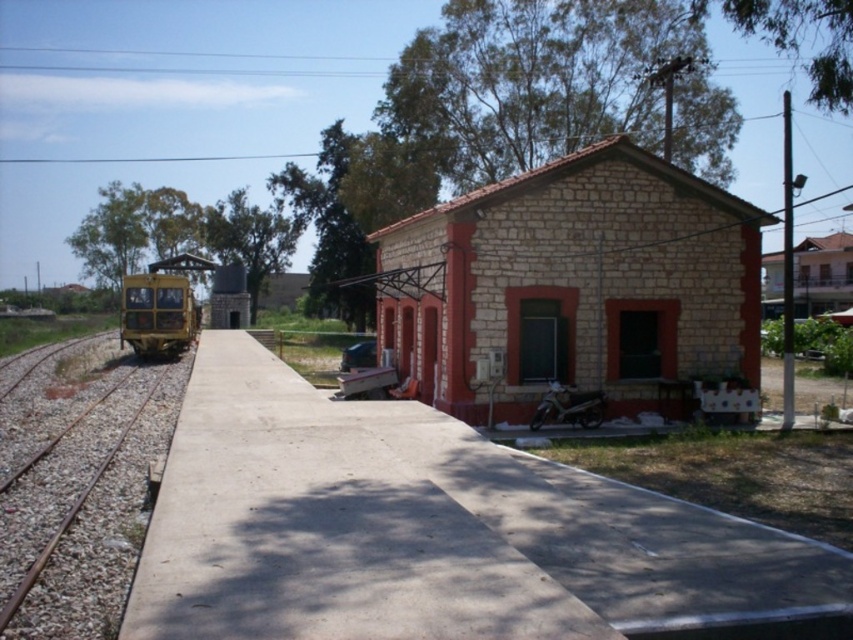
Which is in front, point (189, 637) or point (109, 406)?

Point (189, 637) is more forward.

From the picture: Does concrete platform at center have a greater height compared to brown metal train track at left?

No, concrete platform at center is not taller than brown metal train track at left.

Identify the location of concrete platform at center. This screenshot has height=640, width=853. (434, 532).

Image resolution: width=853 pixels, height=640 pixels. Find the location of `concrete platform at center`. concrete platform at center is located at coordinates (434, 532).

Is concrete platform at center thinner than yellow matte train at left?

In fact, concrete platform at center might be wider than yellow matte train at left.

Can you confirm if concrete platform at center is positioned to the left of yellow matte train at left?

No, concrete platform at center is not to the left of yellow matte train at left.

Locate an element on the screen. The width and height of the screenshot is (853, 640). concrete platform at center is located at coordinates (434, 532).

Is point (390, 413) behind point (666, 317)?

No.

Is the position of concrete platform at center more distant than that of stone brick building at center?

No, concrete platform at center is in front of stone brick building at center.

Is point (440, 500) less distant than point (444, 388)?

That is True.

The width and height of the screenshot is (853, 640). Find the location of `concrete platform at center`. concrete platform at center is located at coordinates (434, 532).